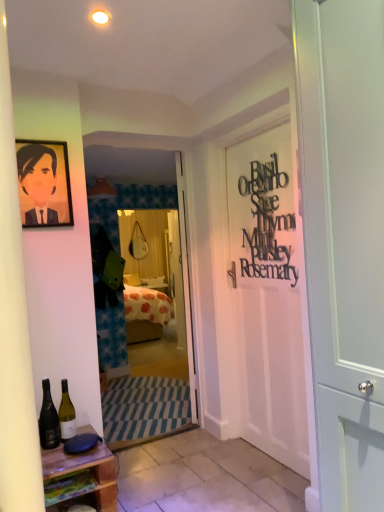
This screenshot has height=512, width=384. Find the location of `free space in front of white wooden door at center, the 2th door positioned from the front`. free space in front of white wooden door at center, the 2th door positioned from the front is located at coordinates (169, 431).